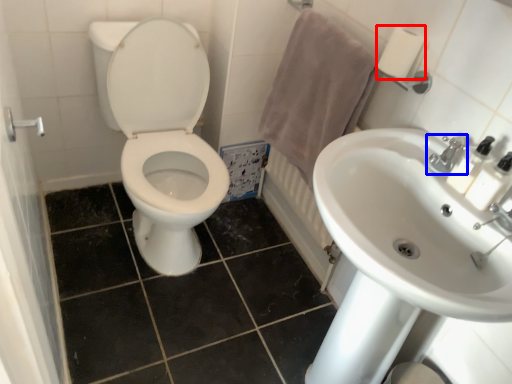
Question: Which object is closer to the camera taking this photo, toilet paper (highlighted by a red box) or tap (highlighted by a blue box)?

Choices:
 (A) toilet paper
 (B) tap

Answer: (B)